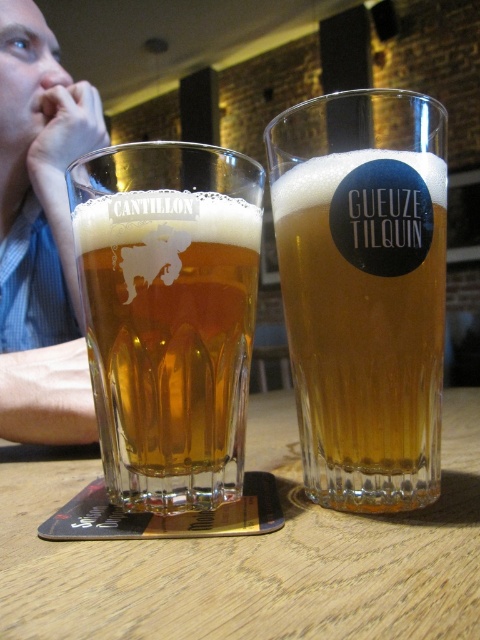
Question: Which point is farther to the camera?

Choices:
 (A) (80, 320)
 (B) (211, 147)

Answer: (A)

Question: Does translucent glass cantillon beer at left have a larger size compared to blue striped shirt at upper left?

Choices:
 (A) yes
 (B) no

Answer: (B)

Question: Can you confirm if wooden table at center is positioned to the right of blue striped shirt at upper left?

Choices:
 (A) no
 (B) yes

Answer: (B)

Question: Considering the relative positions of translucent glass cantillon beer at left and blue striped shirt at upper left in the image provided, where is translucent glass cantillon beer at left located with respect to blue striped shirt at upper left?

Choices:
 (A) above
 (B) below

Answer: (B)

Question: Which of the following is the closest to the observer?

Choices:
 (A) translucent glass cantillon beer at left
 (B) blue striped shirt at upper left
 (C) wooden table at center

Answer: (C)

Question: Estimate the real-world distances between objects in this image. Which object is closer to the wooden table at center?

Choices:
 (A) blue striped shirt at upper left
 (B) clear glass beer at center
 (C) translucent glass cantillon beer at left

Answer: (C)